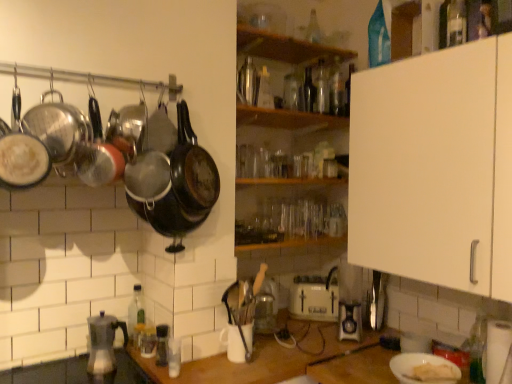
Find the location of a particular element. The image size is (512, 384). vacant area situated below black matte wok at left, which is the sixth wok from left to right (from a real-world perspective) is located at coordinates (183, 369).